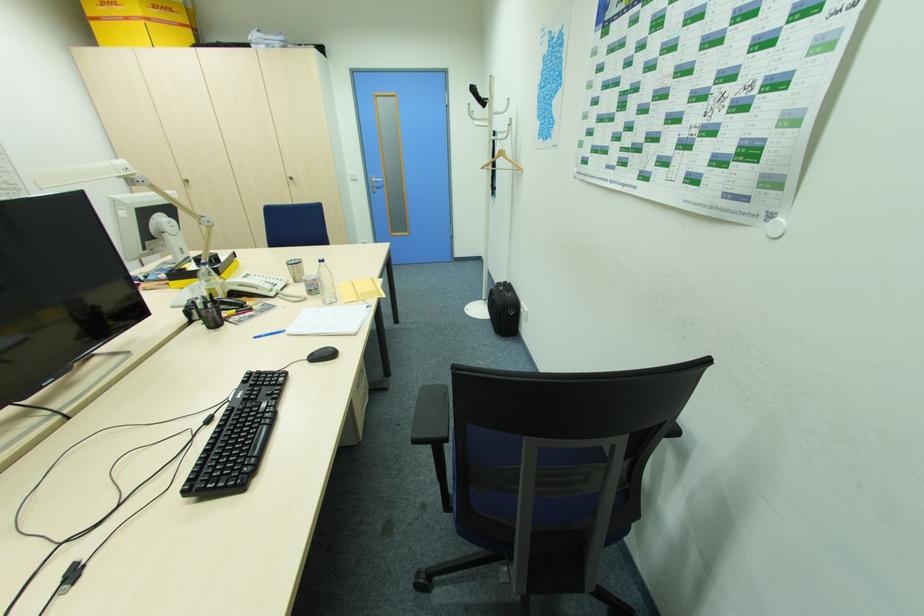
Locate an element on the screen. white notebook is located at coordinates (330, 320).